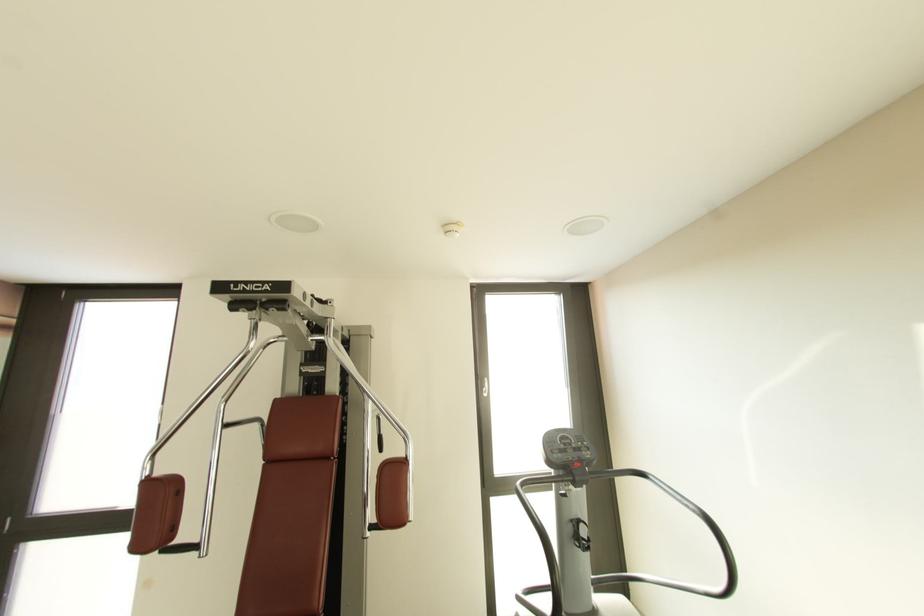
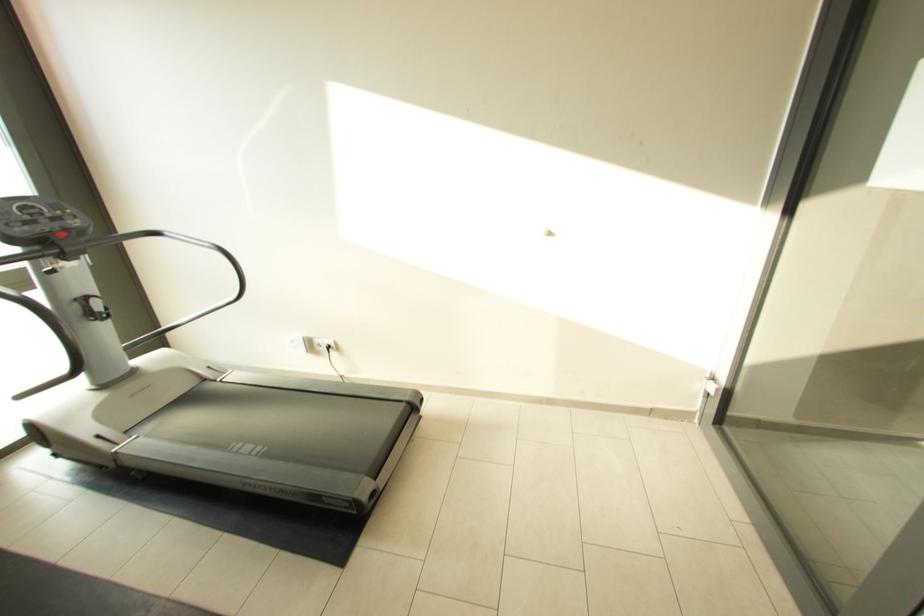
Find the pixel in the second image that matches point (576, 460) in the first image.

(54, 232)